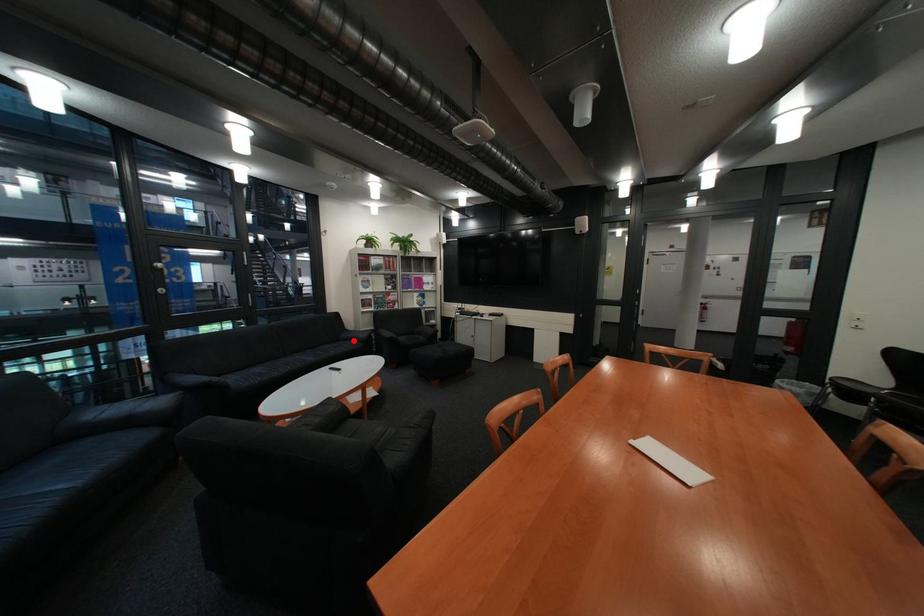
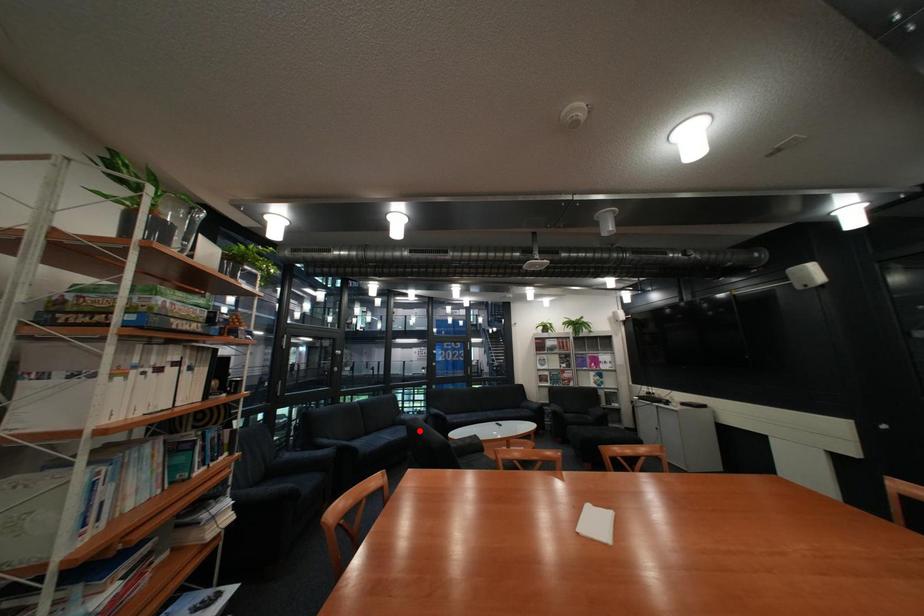
I am providing you with two images of the same scene from different viewpoints. A red point is marked on the first image and another point is marked on the second image. Do the highlighted points in image1 and image2 indicate the same real-world spot?

No